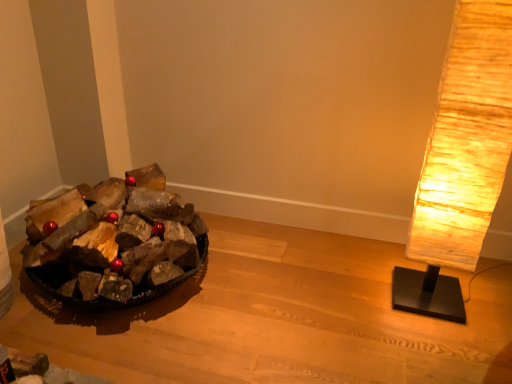
Locate an element on the screen. Image resolution: width=512 pixels, height=384 pixels. vacant area that is in front of rustic paper lamp at right is located at coordinates (441, 346).